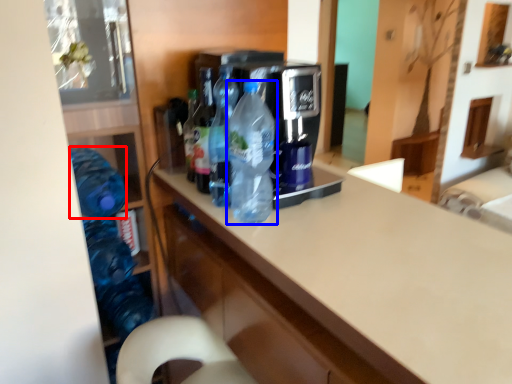
Question: Which object appears closest to the camera in this image, bottle (highlighted by a red box) or bottle (highlighted by a blue box)?

Choices:
 (A) bottle
 (B) bottle

Answer: (B)